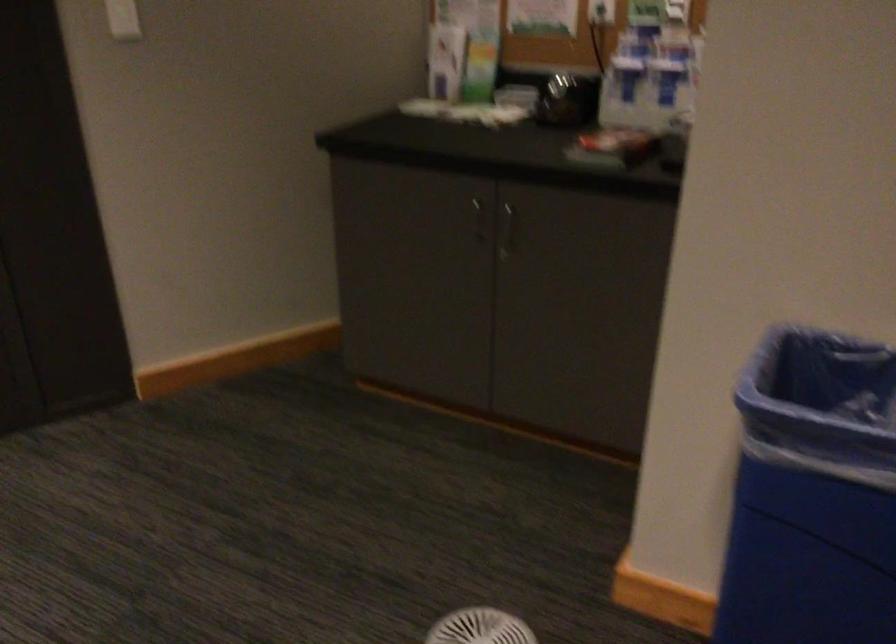
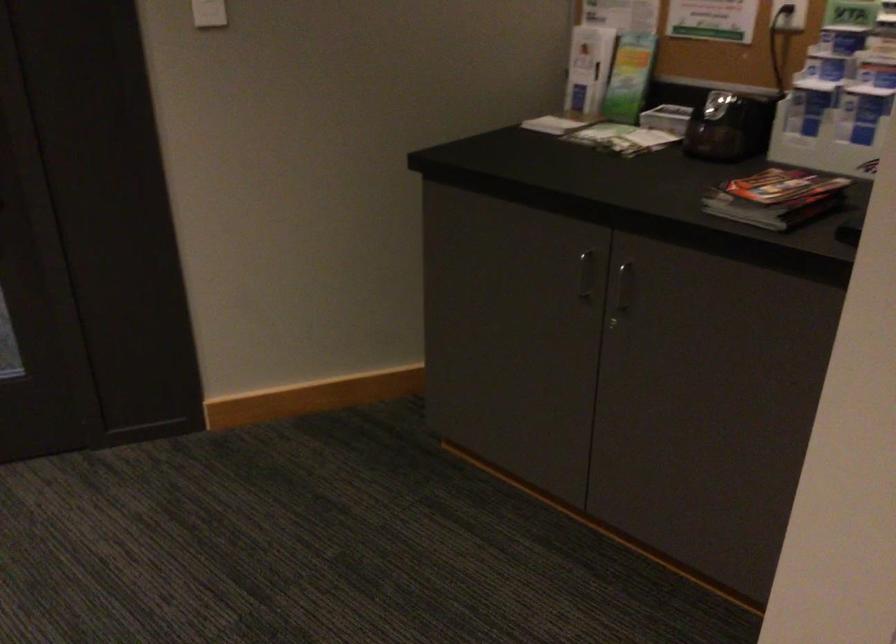
Locate, in the second image, the point that corresponds to (x=617, y=143) in the first image.

(776, 198)